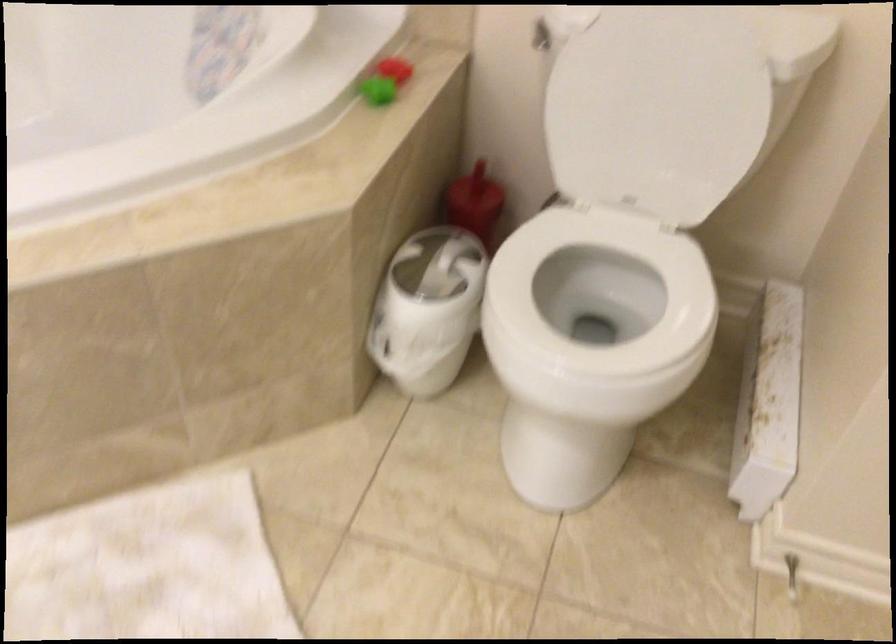
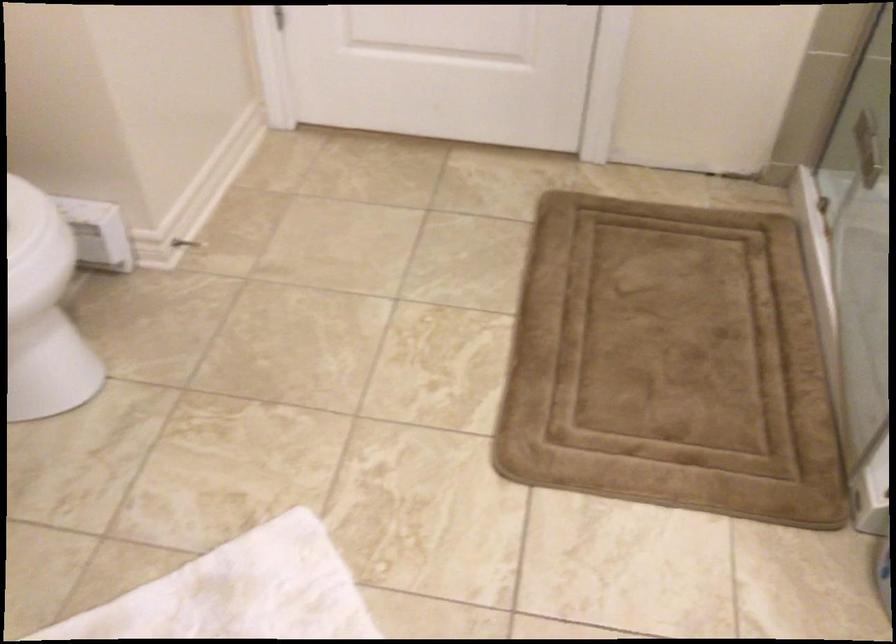
The first image is from the beginning of the video and the second image is from the end. How did the camera likely rotate when shooting the video?

The rotation direction of the camera is right-down.